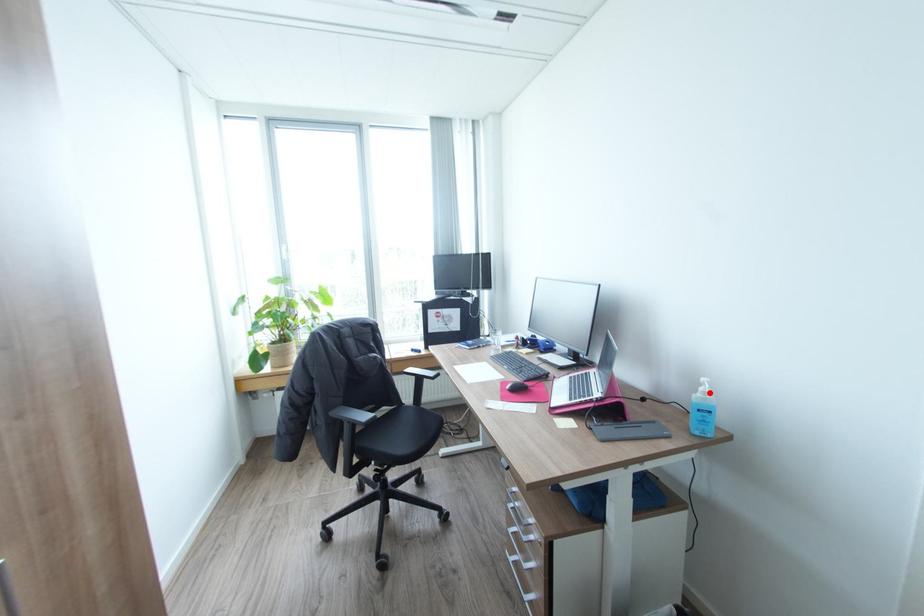
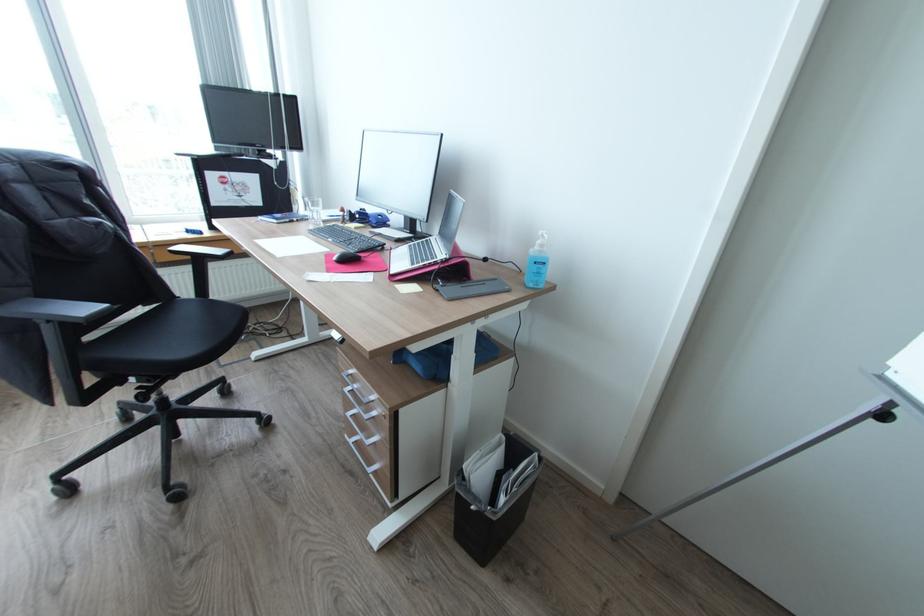
The point at the highlighted location is marked in the first image. Where is the corresponding point in the second image?

(545, 245)